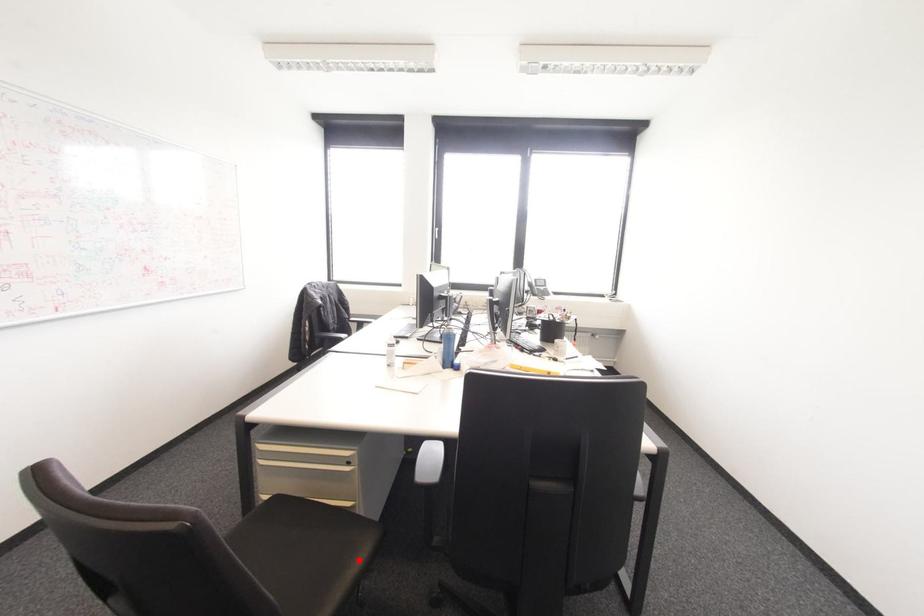
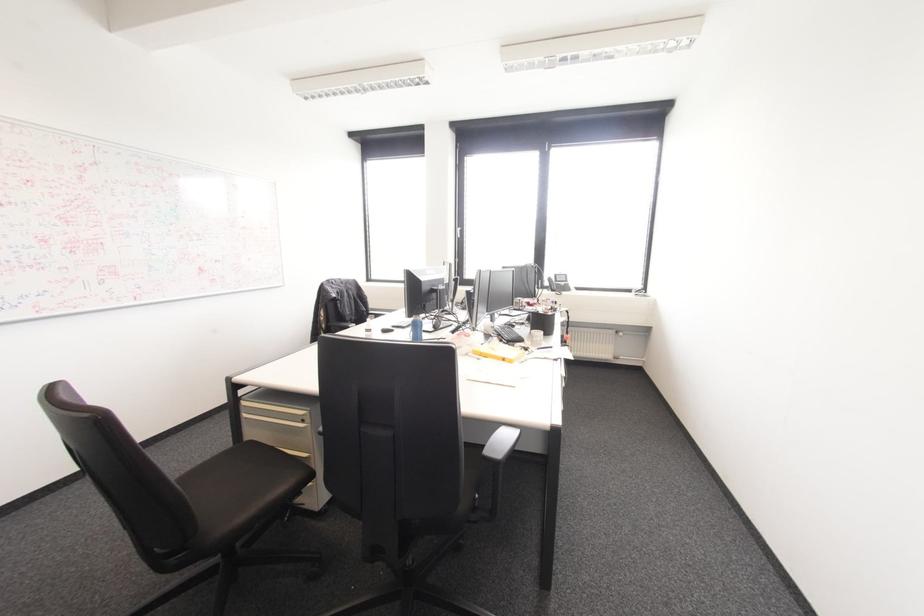
Find the pixel in the second image that matches the highlighted location in the first image.

(281, 488)